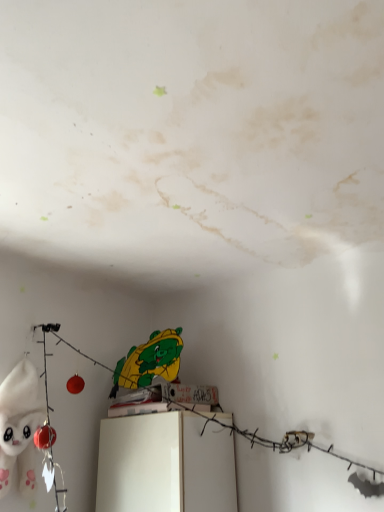
This screenshot has width=384, height=512. Identify the location of white glossy cabinet at center. (165, 464).

Image resolution: width=384 pixels, height=512 pixels. What do you see at coordinates (165, 464) in the screenshot? I see `white glossy cabinet at center` at bounding box center [165, 464].

Identify the location of white plush toy at left. (19, 426).

The width and height of the screenshot is (384, 512). What do you see at coordinates (19, 426) in the screenshot?
I see `white plush toy at left` at bounding box center [19, 426].

You are a GUI agent. You are given a task and a screenshot of the screen. Output one action in this format:
    pyautogui.click(x=<x>, y=<y>)
    Task: Click on the white glossy cabinet at center
    The image size is (384, 512).
    Given the screenshot: What is the action you would take?
    pyautogui.click(x=165, y=464)

Does white glossy cabinet at center appear on the left side of white plush toy at left?

In fact, white glossy cabinet at center is to the right of white plush toy at left.

Between white glossy cabinet at center and white plush toy at left, which one is positioned behind?

white glossy cabinet at center is further from the camera.

Which point is more forward, (x=229, y=416) or (x=28, y=364)?

The point (x=28, y=364) is in front.

From the image's perspective, which one is positioned lower, white glossy cabinet at center or white plush toy at left?

From the image's view, white glossy cabinet at center is below.

From a real-world perspective, relative to white plush toy at left, is white glossy cabinet at center vertically above or below?

white glossy cabinet at center is below white plush toy at left.

Considering the relative sizes of white glossy cabinet at center and white plush toy at left in the image provided, is white glossy cabinet at center wider than white plush toy at left?

Yes.

Considering the sizes of objects white glossy cabinet at center and white plush toy at left in the image provided, who is taller, white glossy cabinet at center or white plush toy at left?

white plush toy at left is taller.

Can you confirm if white glossy cabinet at center is smaller than white plush toy at left?

Incorrect, white glossy cabinet at center is not smaller in size than white plush toy at left.

Is white plush toy at left a part of white glossy cabinet at center?

No, white plush toy at left is not surrounded by white glossy cabinet at center.

Does white glossy cabinet at center touch white plush toy at left?

No.

Is white glossy cabinet at center positioned with its back to white plush toy at left?

No, white glossy cabinet at center is not facing the opposite direction of white plush toy at left.

Can you tell me how much white glossy cabinet at center and white plush toy at left differ in facing direction?

There is a 91.9-degree angle between the facing directions of white glossy cabinet at center and white plush toy at left.

What are the coordinates of `furniture located on the right of white plush toy at left` in the screenshot? It's located at (165, 464).

Considering the positions of objects white plush toy at left and white glossy cabinet at center in the image provided, who is more to the left, white plush toy at left or white glossy cabinet at center?

Positioned to the left is white plush toy at left.

Which object is further away from the camera, white plush toy at left or white glossy cabinet at center?

white glossy cabinet at center is more distant.

Is point (34, 399) positioned after point (157, 438)?

Yes, it is.

From the image's perspective, is white plush toy at left on white glossy cabinet at center?

Yes, from the image's perspective, white plush toy at left is above white glossy cabinet at center.

From a real-world perspective, between white plush toy at left and white glossy cabinet at center, who is vertically lower?

white glossy cabinet at center, from a real-world perspective.

Considering the sizes of objects white plush toy at left and white glossy cabinet at center in the image provided, who is wider, white plush toy at left or white glossy cabinet at center?

With larger width is white glossy cabinet at center.

Considering the relative sizes of white plush toy at left and white glossy cabinet at center in the image provided, is white plush toy at left taller than white glossy cabinet at center?

Yes.

Considering the sizes of objects white plush toy at left and white glossy cabinet at center in the image provided, who is bigger, white plush toy at left or white glossy cabinet at center?

white glossy cabinet at center.

Is white plush toy at left not inside white glossy cabinet at center?

Yes, white plush toy at left is located beyond the bounds of white glossy cabinet at center.

From the picture: Can you see white plush toy at left touching white glossy cabinet at center?

No.

Could you tell me if white plush toy at left is facing white glossy cabinet at center?

No.

How many degrees apart are the facing directions of white plush toy at left and white glossy cabinet at center?

The angle between the facing direction of white plush toy at left and the facing direction of white glossy cabinet at center is 91.9 degrees.

This screenshot has height=512, width=384. What are the coordinates of `toy on the left of the white glossy cabinet at center` in the screenshot? It's located at (19, 426).

You are a GUI agent. You are given a task and a screenshot of the screen. Output one action in this format:
    pyautogui.click(x=<x>, y=<y>)
    Task: Click on the furniture lying on the right of white plush toy at left
    This screenshot has width=384, height=512.
    Given the screenshot: What is the action you would take?
    pyautogui.click(x=165, y=464)

Locate an element on the screen. The image size is (384, 512). furniture behind the white plush toy at left is located at coordinates (165, 464).